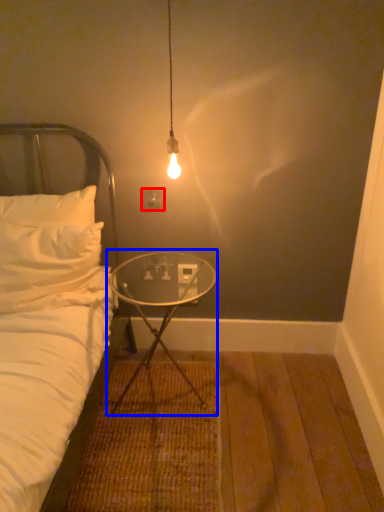
Question: Which point is closer to the camera, electric outlet (highlighted by a red box) or table (highlighted by a blue box)?

Choices:
 (A) electric outlet
 (B) table

Answer: (B)